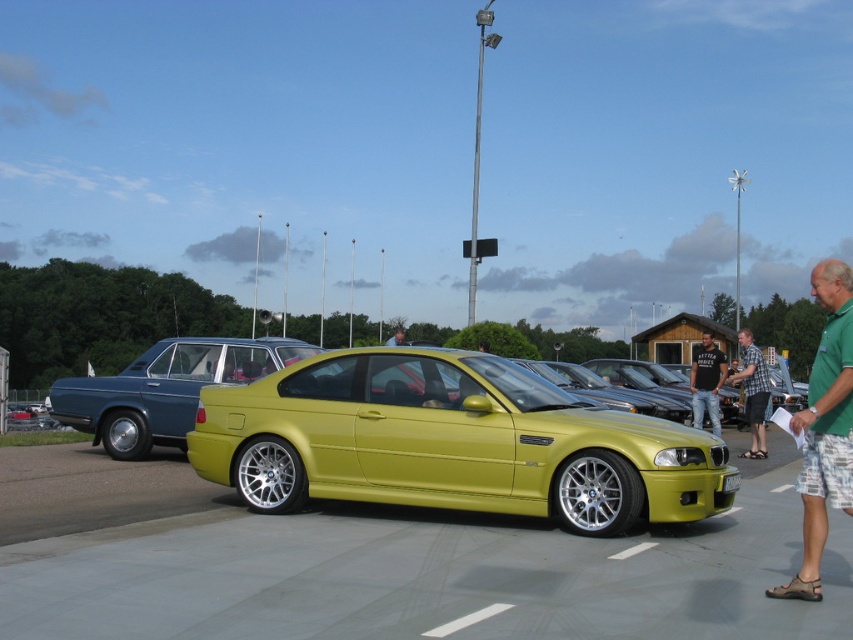
Question: Can you confirm if green fabric shirt at right is thinner than plaid shirt at center?

Choices:
 (A) yes
 (B) no

Answer: (B)

Question: Is metallic yellow sports car at center below metallic blue sedan at left?

Choices:
 (A) no
 (B) yes

Answer: (B)

Question: Which point appears closest to the camera in this image?

Choices:
 (A) (738, 337)
 (B) (730, 484)

Answer: (B)

Question: Among these points, which one is farthest from the camera?

Choices:
 (A) (730, 486)
 (B) (780, 588)
 (C) (183, 419)
 (D) (399, 336)

Answer: (D)

Question: Which object appears farthest from the camera in this image?

Choices:
 (A) metallic blue sedan at left
 (B) metallic yellow car at center

Answer: (A)

Question: Is metallic blue sedan at left positioned at the back of black cotton shirt at center?

Choices:
 (A) yes
 (B) no

Answer: (B)